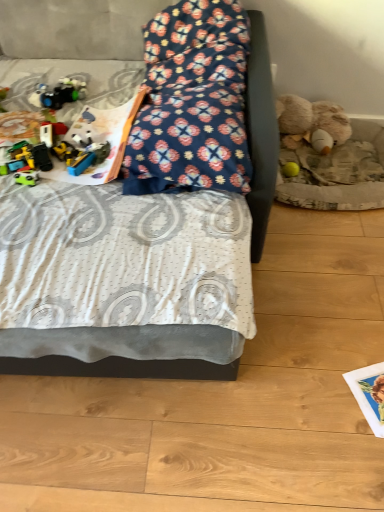
The width and height of the screenshot is (384, 512). I want to click on free space in front of yellow rubber ball at lower right, the third toy from the left, so (x=306, y=209).